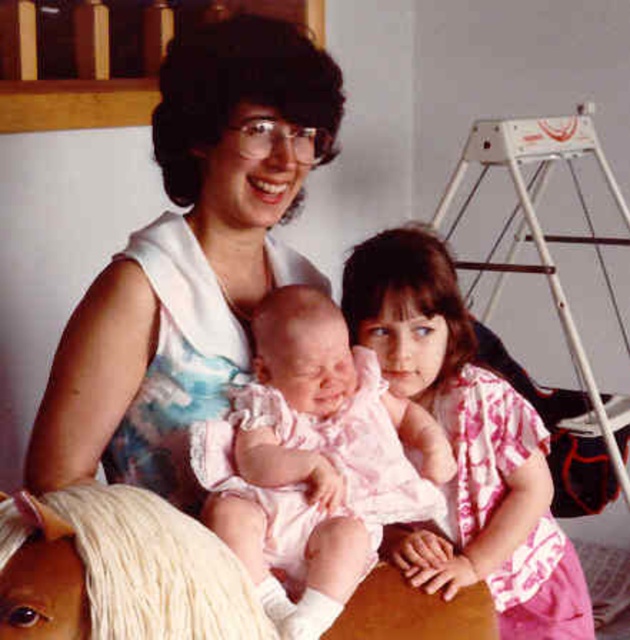
Does pink satin dress at center have a lesser height compared to pink floral shirt at center?

Indeed, pink satin dress at center has a lesser height compared to pink floral shirt at center.

Which is more to the right, pink satin dress at center or pink floral shirt at center?

From the viewer's perspective, pink floral shirt at center appears more on the right side.

Between point (372, 531) and point (370, 339), which one is positioned behind?

Point (370, 339)

Where is `pink satin dress at center`? The width and height of the screenshot is (630, 640). pink satin dress at center is located at coordinates (312, 461).

Does pink floral shirt at center come in front of white plush horse at lower left?

No.

How far apart are pink floral shirt at center and white plush horse at lower left?

pink floral shirt at center is 29.26 inches from white plush horse at lower left.

What do you see at coordinates (466, 444) in the screenshot? Image resolution: width=630 pixels, height=640 pixels. I see `pink floral shirt at center` at bounding box center [466, 444].

Where is `pink floral shirt at center`? The height and width of the screenshot is (640, 630). pink floral shirt at center is located at coordinates (466, 444).

Does pink satin dress at center come in front of white plush horse at lower left?

No, pink satin dress at center is behind white plush horse at lower left.

Which is behind, point (343, 564) or point (88, 486)?

The point (343, 564) is behind.

At what (x,y) coordinates should I click in order to perform the action: click on pink satin dress at center. Please return your answer as a coordinate pair (x, y). The height and width of the screenshot is (640, 630). Looking at the image, I should click on (312, 461).